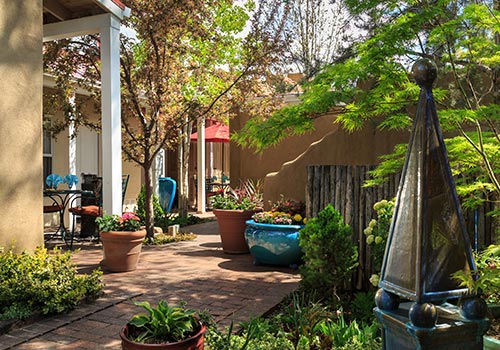
This screenshot has height=350, width=500. Identify the location of table. (68, 208).